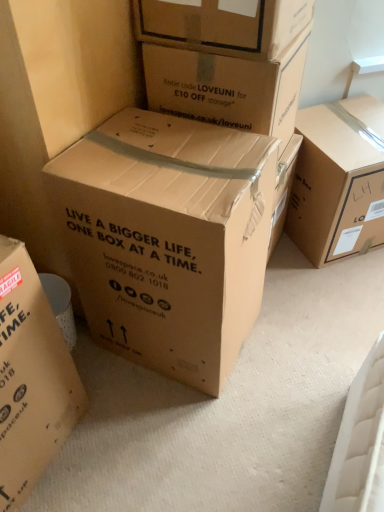
Where is `vacant space to the right of brown cardboard box at center, the 3th box viewed from the left`? This screenshot has width=384, height=512. vacant space to the right of brown cardboard box at center, the 3th box viewed from the left is located at coordinates pyautogui.click(x=295, y=335).